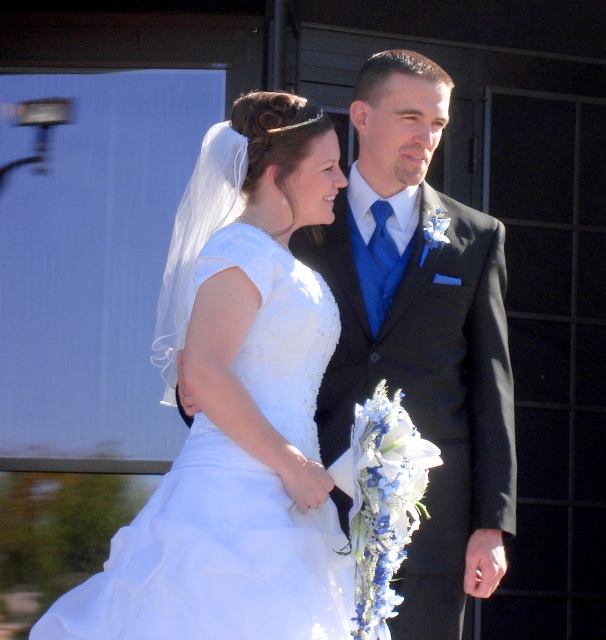
Question: Which point is closer to the camera?

Choices:
 (A) (278, 566)
 (B) (410, 404)

Answer: (A)

Question: Can you confirm if shiny black suit at center is smaller than white satin dress at center?

Choices:
 (A) yes
 (B) no

Answer: (A)

Question: Considering the relative positions of shiny black suit at center and white satin dress at center in the image provided, where is shiny black suit at center located with respect to white satin dress at center?

Choices:
 (A) below
 (B) above

Answer: (B)

Question: Observing the image, what is the correct spatial positioning of shiny black suit at center in reference to white satin dress at center?

Choices:
 (A) left
 (B) right

Answer: (B)

Question: Which point is closer to the camera?

Choices:
 (A) (333, 300)
 (B) (421, 362)

Answer: (A)